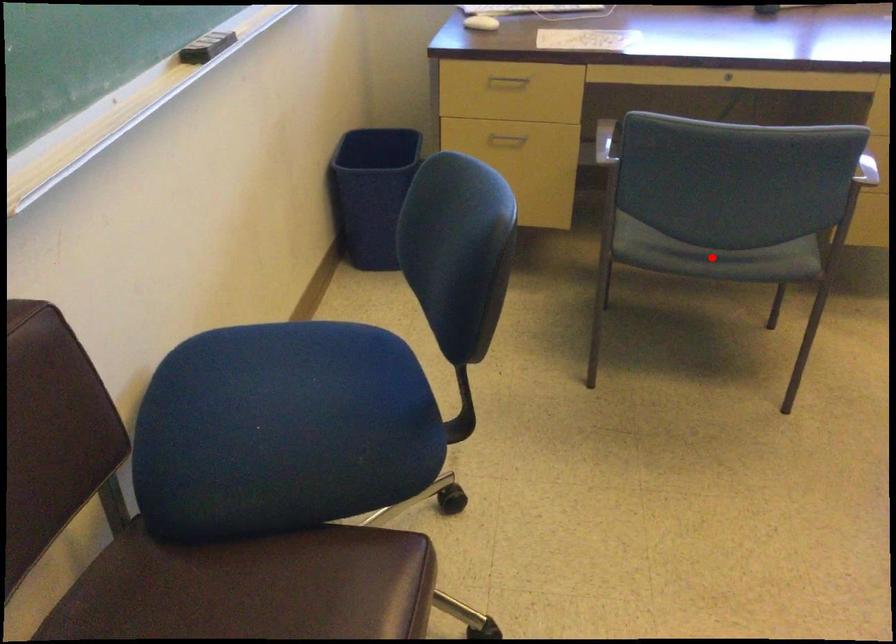
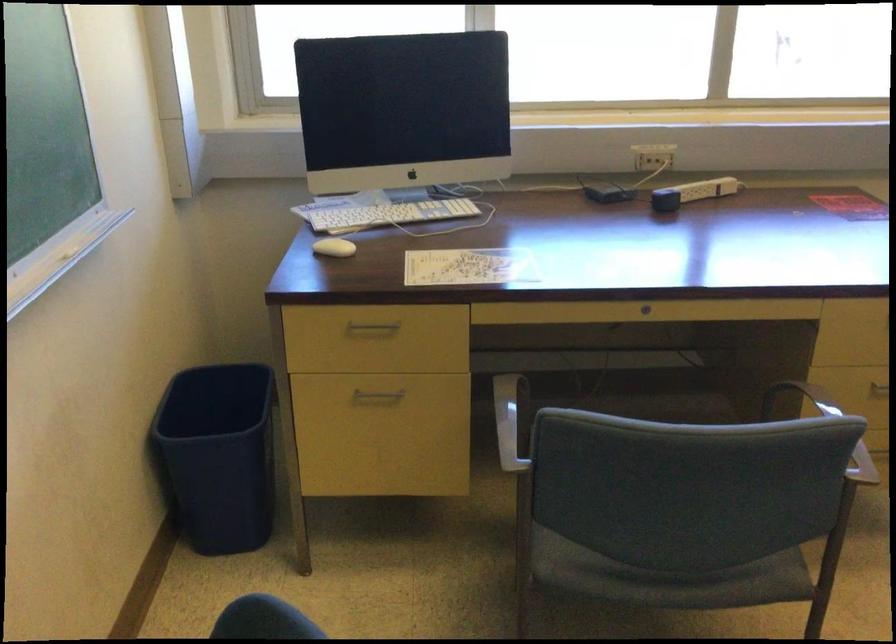
Question: I am providing you with two images of the same scene from different viewpoints. Image1 has a red point marked. In image2, the corresponding 3D location appears at what relative position? Reply with the corresponding letter.

Choices:
 (A) Closer
 (B) Farther

Answer: (A)